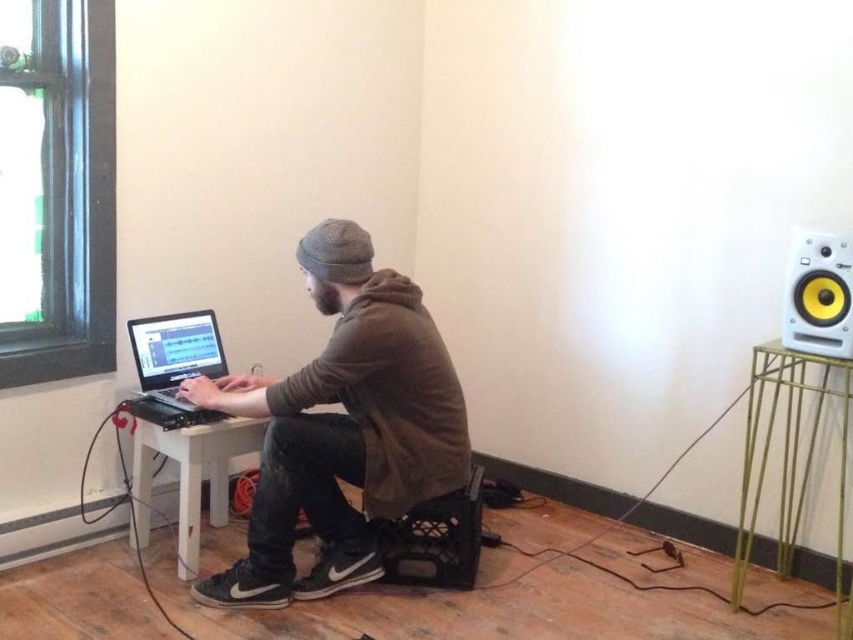
You are organizing a small workspace and need to place a new 12x12 inch square organizer. You have the white wood table at lower left and the black matte laptop at left. Which surface can accommodate the organizer without overlapping?

The white wood table at lower left is larger in size than the black matte laptop at left, so the organizer can fit on the white wood table at lower left.

You are a delivery robot with a package that needs to be placed on the white wood table at lower left. You are currently positioned near the brown matte hoodie at center. Can you move the package directly to the table without needing to adjust your position?

The brown matte hoodie at center and white wood table at lower left are 30.66 centimeters apart from each other. Since the distance is relatively short, the delivery robot can likely move the package directly to the table without needing to adjust its position.